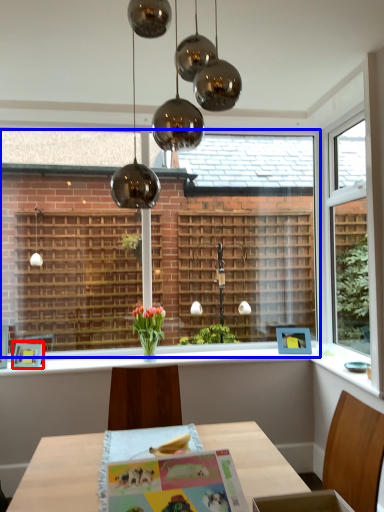
Question: Which point is further to the camera, picture frame (highlighted by a red box) or bay window (highlighted by a blue box)?

Choices:
 (A) picture frame
 (B) bay window

Answer: (B)